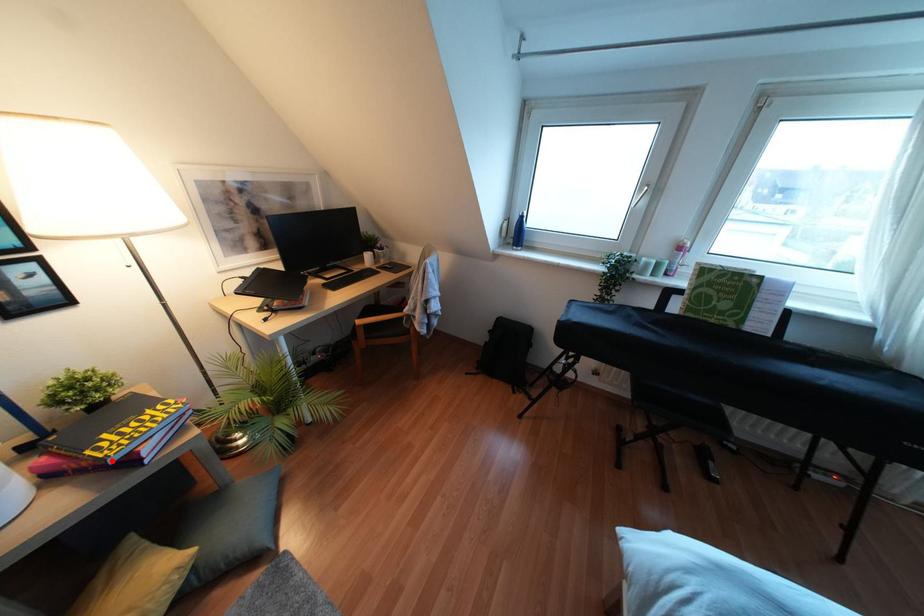
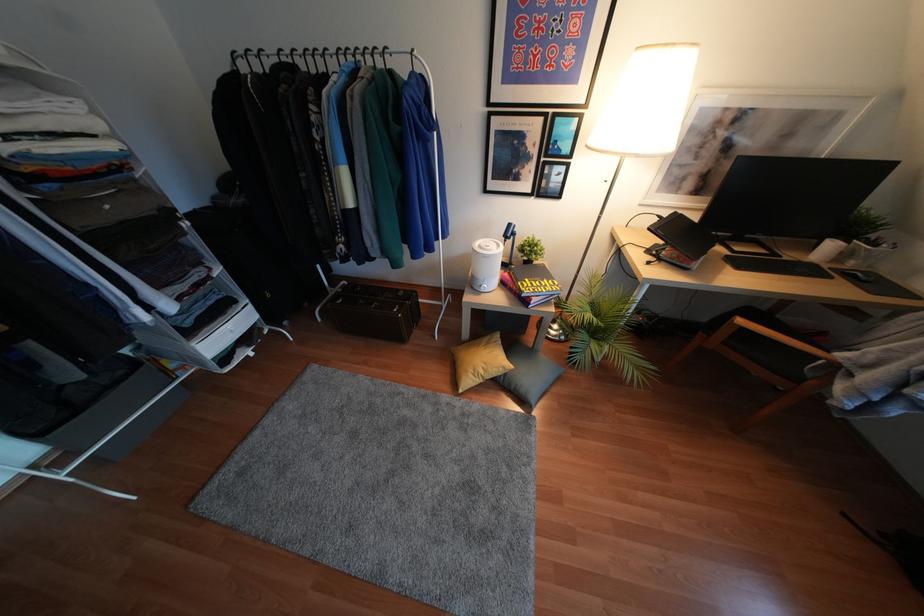
Find the pixel in the second image that matches the highlighted location in the first image.

(523, 294)